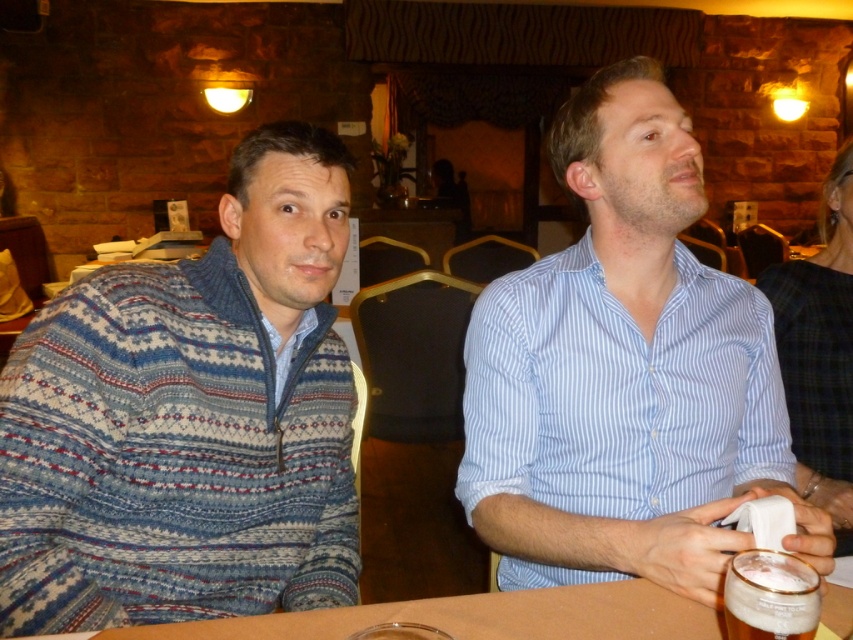
Is the position of blue striped shirt at center less distant than that of foamy white beer at lower right?

No, it is not.

Looking at this image, measure the distance between point (628, 428) and camera.

Point (628, 428) and camera are 1.03 meters apart from each other.

You are a GUI agent. You are given a task and a screenshot of the screen. Output one action in this format:
    pyautogui.click(x=<x>, y=<y>)
    Task: Click on the blue striped shirt at center
    
    Given the screenshot: What is the action you would take?
    pyautogui.click(x=625, y=372)

The height and width of the screenshot is (640, 853). Find the location of `blue striped shirt at center`. blue striped shirt at center is located at coordinates (625, 372).

Looking at this image, between brown wooden table at center and foamy white beer at lower right, which one is positioned lower?

brown wooden table at center is below.

Which is in front, point (566, 618) or point (730, 566)?

Point (730, 566) is in front.

This screenshot has width=853, height=640. Identify the location of brown wooden table at center. (479, 616).

Consider the image. Is knitted sweater at left in front of foamy white beer at lower right?

That is False.

Locate an element on the screen. Image resolution: width=853 pixels, height=640 pixels. knitted sweater at left is located at coordinates (190, 419).

Identify the location of knitted sweater at left. (190, 419).